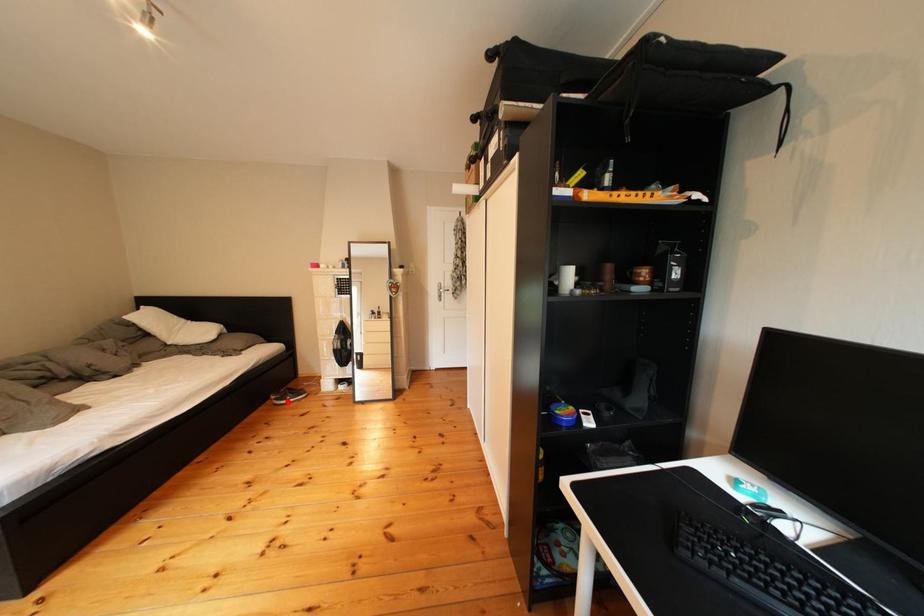
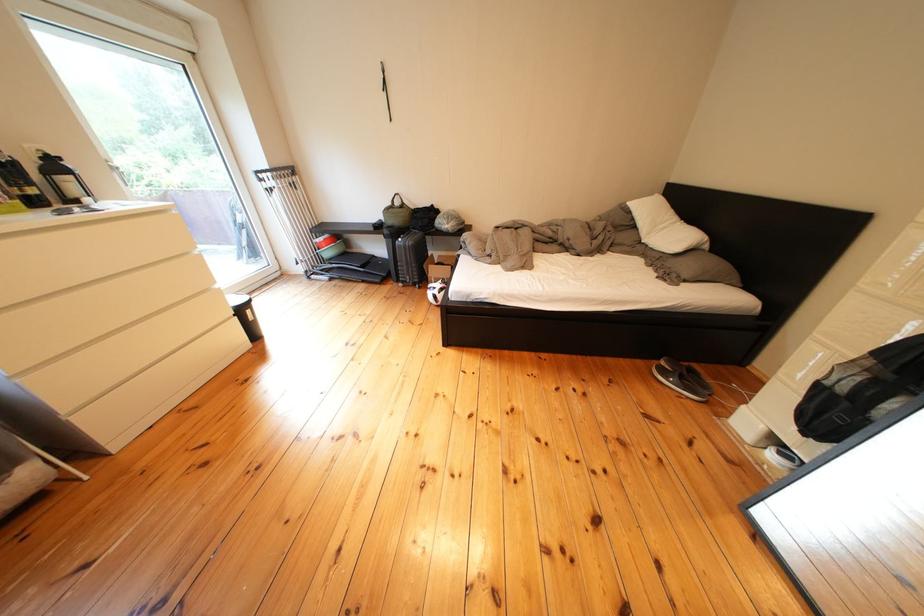
In the second image, find the point that corresponds to the highlighted location in the first image.

(676, 368)